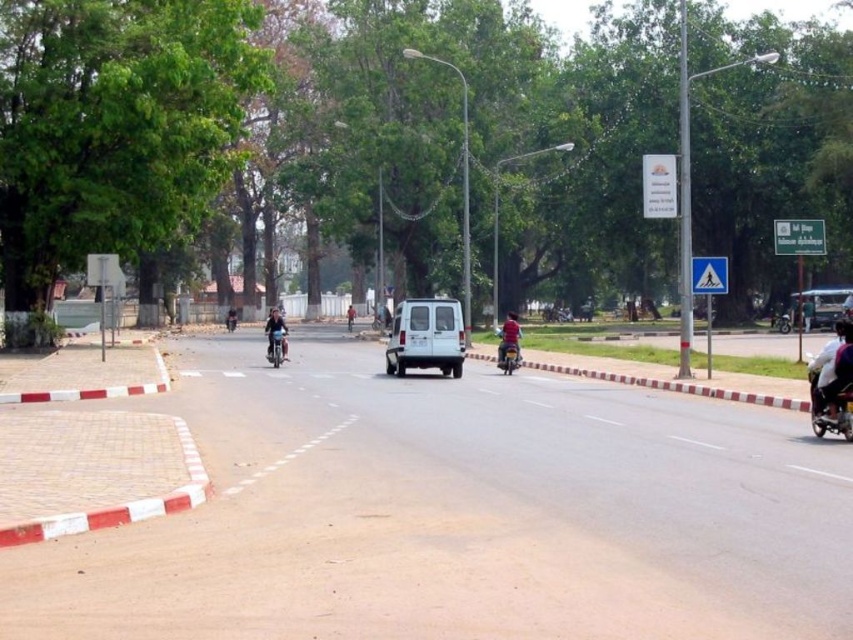
Does point (265, 330) come farther from viewer compared to point (503, 342)?

Yes.

Identify the location of dark blue motorcycle at center. (276, 333).

Locate an element on the screen. The height and width of the screenshot is (640, 853). dark blue motorcycle at center is located at coordinates (276, 333).

Who is positioned more to the right, metallic silver van at center or dark blue motorcycle at center?

metallic silver van at center is more to the right.

Who is lower down, metallic silver van at center or dark blue motorcycle at center?

Positioned lower is dark blue motorcycle at center.

Does point (787, 301) lie behind point (268, 349)?

Yes.

At what (x,y) coordinates should I click in order to perform the action: click on metallic silver van at center. Please return your answer as a coordinate pair (x, y). Image resolution: width=853 pixels, height=640 pixels. Looking at the image, I should click on (822, 307).

Is point (440, 344) less distant than point (351, 316)?

Yes, it is in front of point (351, 316).

Is white matte van at center smaller than red fabric helmet at center?

Yes.

Is point (445, 323) positioned after point (347, 307)?

That is False.

This screenshot has height=640, width=853. What are the coordinates of `white matte van at center` in the screenshot? It's located at (426, 337).